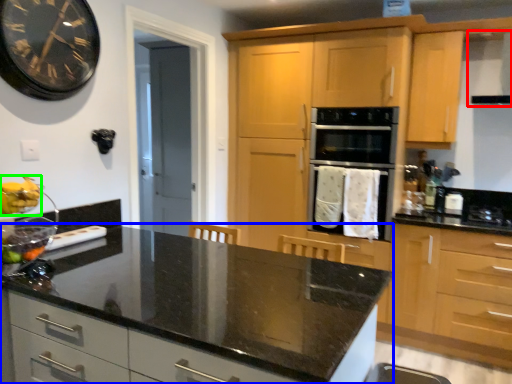
Question: Which is nearer to the exhaust hood (highlighted by a red box)? countertop (highlighted by a blue box) or banana (highlighted by a green box).

Choices:
 (A) countertop
 (B) banana

Answer: (A)